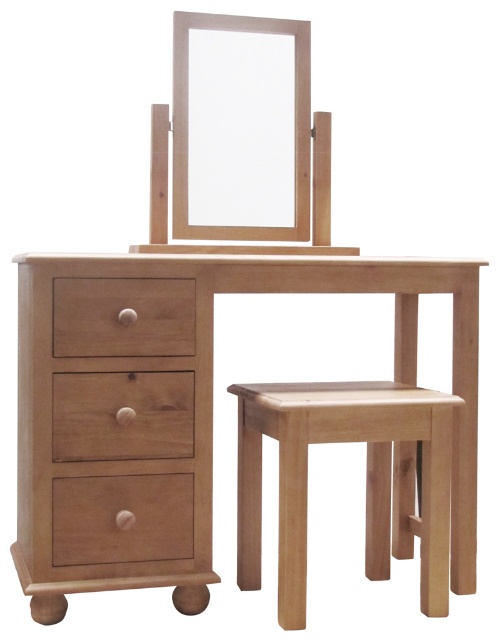
You are trying to decide where to place a new floor lamp in your bedroom. The natural wood table at center and the matte wood mirror at center are already in the room. Which object should you place the lamp next to so that it doesn

The natural wood table at center is much taller than the matte wood mirror at center, so placing the floor lamp next to the natural wood table at center would ensure better visibility and balance in the room.

You are standing in a room and see the natural wood table at center. Can you determine its exact 2D coordinates based on the room layout?

The natural wood table at center is located at coordinates point (x=178, y=408).